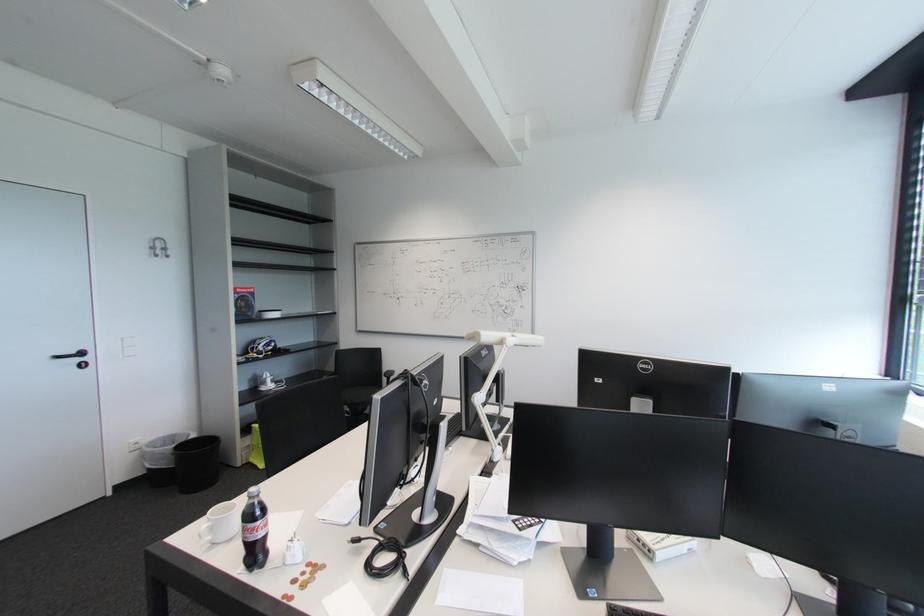
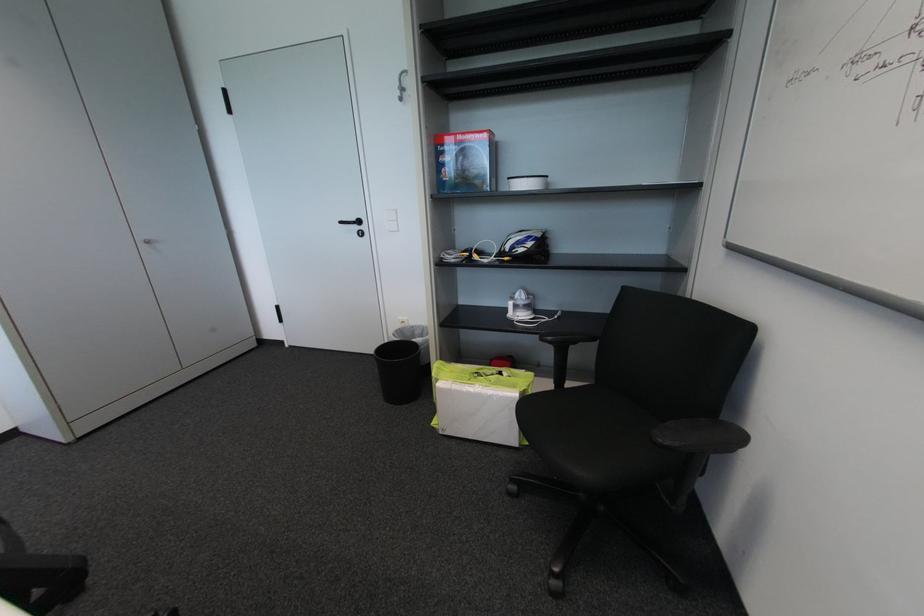
Find the pixel in the second image that matches point (83, 361) in the first image.

(362, 229)